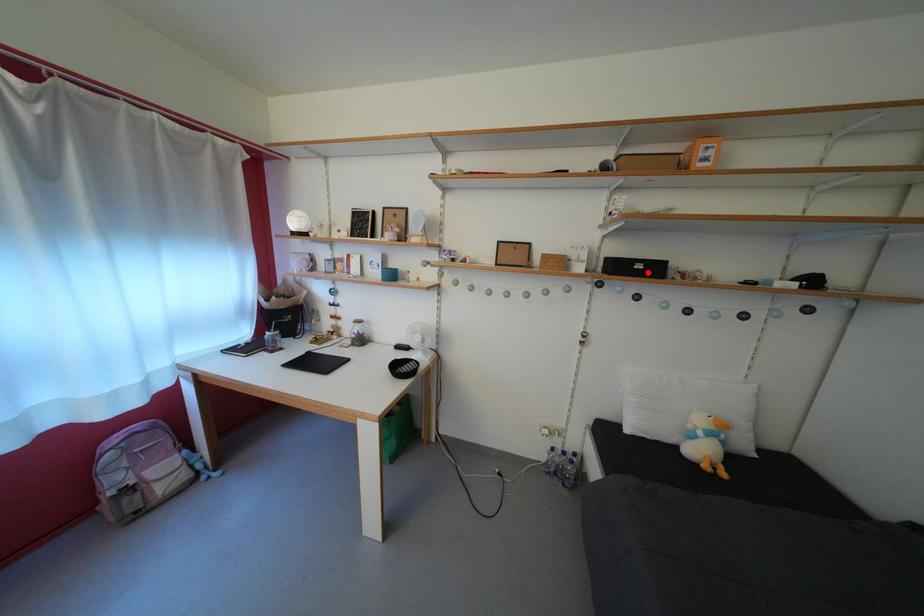
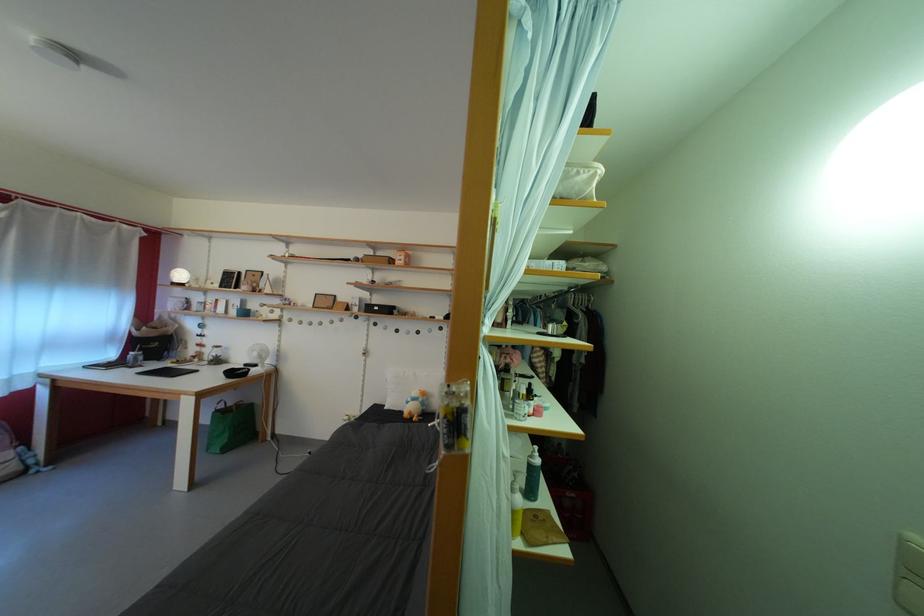
Find the pixel in the second image that matches the highlighted location in the first image.

(384, 314)